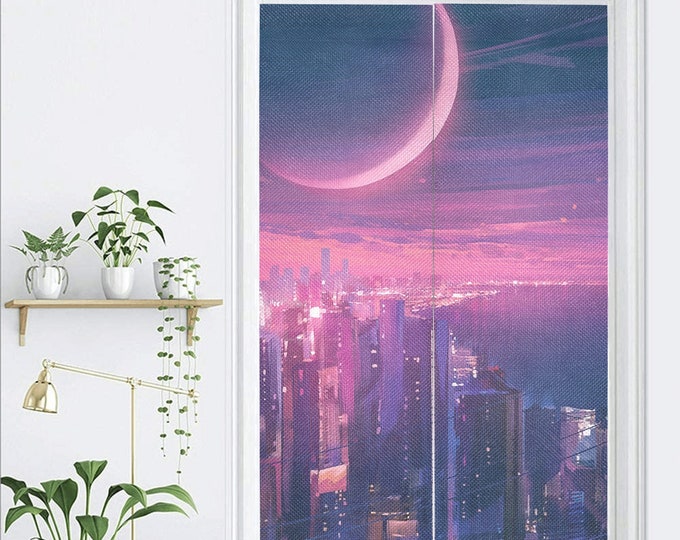
I want to click on large rectangular canvas wall art panels, so click(262, 9), click(437, 8).